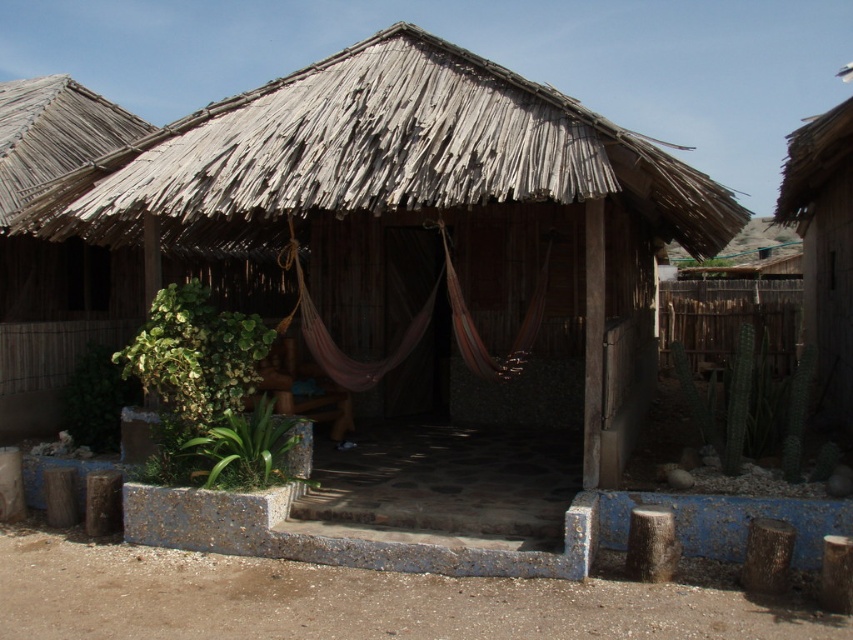
Question: Is natural thatch roof at center smaller than wooden hut at right?

Choices:
 (A) yes
 (B) no

Answer: (A)

Question: Which point is closer to the camera?

Choices:
 (A) wooden hut at right
 (B) natural thatch roof at center

Answer: (B)

Question: Does natural thatch roof at center appear on the right side of wooden hut at right?

Choices:
 (A) no
 (B) yes

Answer: (A)

Question: Does natural thatch roof at center have a greater width compared to wooden hut at right?

Choices:
 (A) no
 (B) yes

Answer: (A)

Question: Which point is farther to the camera?

Choices:
 (A) natural thatch roof at center
 (B) wooden hut at right

Answer: (B)

Question: Which point appears farthest from the camera in this image?

Choices:
 (A) [x=809, y=152]
 (B) [x=312, y=163]

Answer: (A)